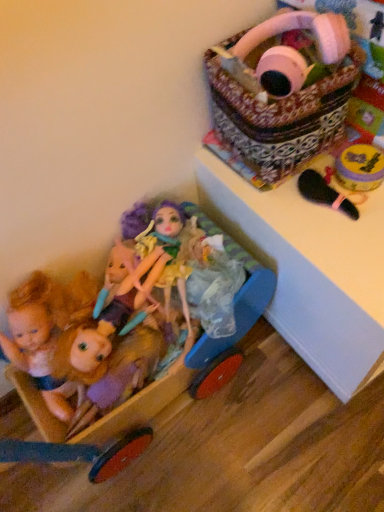
Question: Is patterned fabric basket at upper right wider or thinner than wooden baby carriage at lower left?

Choices:
 (A) thin
 (B) wide

Answer: (A)

Question: Considering their positions, is patterned fabric basket at upper right located in front of or behind wooden baby carriage at lower left?

Choices:
 (A) front
 (B) behind

Answer: (B)

Question: Which object is positioned farthest from the patterned fabric basket at upper right?

Choices:
 (A) white glossy changing table at upper right
 (B) shiny purple hair at center, the 1th doll when ordered from right to left
 (C) pastel purple fabric doll at lower left, placed as the 2th doll when sorted from left to right
 (D) matte plastic dolls at lower left, the third doll from the right
 (E) wooden baby carriage at lower left

Answer: (D)

Question: Based on their relative distances, which object is nearer to the white glossy changing table at upper right?

Choices:
 (A) matte plastic dolls at lower left, the third doll from the right
 (B) shiny purple hair at center, the 1th doll when ordered from right to left
 (C) patterned fabric basket at upper right
 (D) wooden baby carriage at lower left
 (E) pastel purple fabric doll at lower left, placed as the 2th doll when sorted from left to right

Answer: (D)